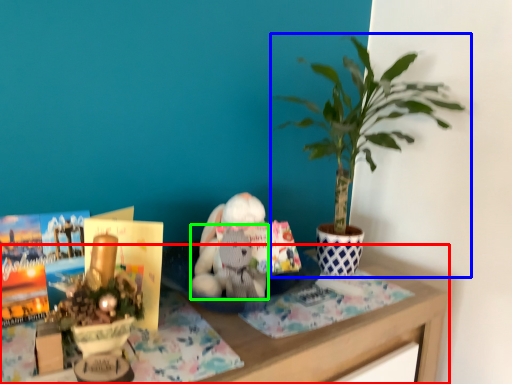
Question: Which object is positioned closest to table (highlighted by a red box)? Select from houseplant (highlighted by a blue box) and animal (highlighted by a green box).

Choices:
 (A) houseplant
 (B) animal

Answer: (B)